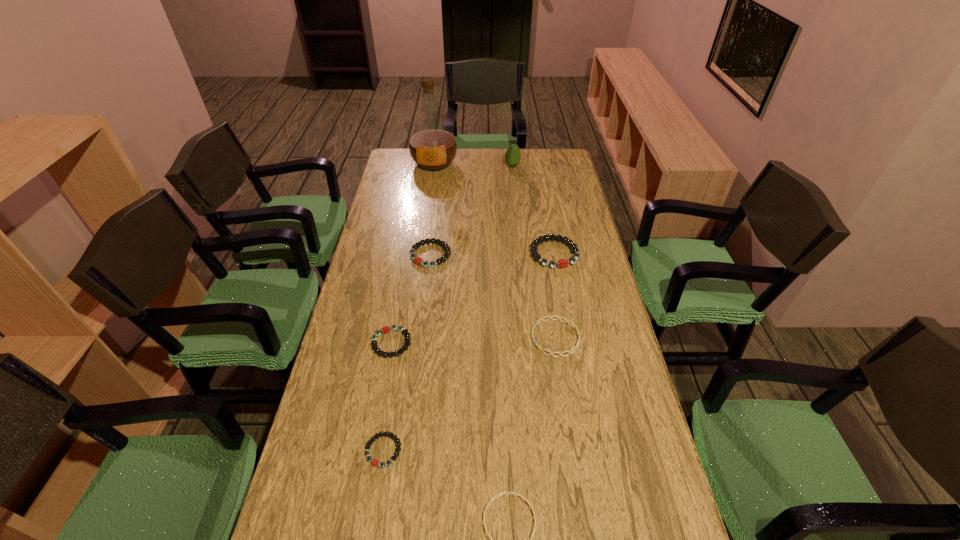
Find the location of a particular element. The image size is (960, 540). vacant area that lies between the bigger blue bracelet and the seventh farthest object is located at coordinates (469, 394).

You are a GUI agent. You are given a task and a screenshot of the screen. Output one action in this format:
    pyautogui.click(x=<x>, y=<y>)
    Task: Click on the free space that is in between the nearest black bracelet and the seventh shortest object
    The width and height of the screenshot is (960, 540).
    Given the screenshot: What is the action you would take?
    pyautogui.click(x=447, y=308)

The height and width of the screenshot is (540, 960). I want to click on vacant space that is in between the second smallest black bracelet and the second biggest black bracelet, so click(411, 299).

Identify which object is the nearest to the second biggest black bracelet. Please provide its 2D coordinates. Your answer should be formatted as a tuple, i.e. [(x, y)], where the tuple contains the x and y coordinates of a point satisfying the conditions above.

[(386, 329)]

Identify the location of object that is the third closest to the fifth farthest bracelet. (559, 318).

Select which bracelet is the third closest to the liquor. Please provide its 2D coordinates. Your answer should be formatted as a tuple, i.e. [(x, y)], where the tuple contains the x and y coordinates of a point satisfying the conditions above.

[(386, 329)]

The width and height of the screenshot is (960, 540). Find the location of `bracelet that stands as the fifth closest to the liquor`. bracelet that stands as the fifth closest to the liquor is located at coordinates (375, 462).

Identify which black bracelet is the closest to the fourth tallest object. Please provide its 2D coordinates. Your answer should be formatted as a tuple, i.e. [(x, y)], where the tuple contains the x and y coordinates of a point satisfying the conditions above.

[(386, 329)]

Identify which black bracelet is the third closest to the nearest object. Please provide its 2D coordinates. Your answer should be formatted as a tuple, i.e. [(x, y)], where the tuple contains the x and y coordinates of a point satisfying the conditions above.

[(560, 263)]

I want to click on vacant space that satisfies the following two spatial constraints: 1. on the front label of the tallest object; 2. on the left side of the third smallest black bracelet, so click(x=421, y=255).